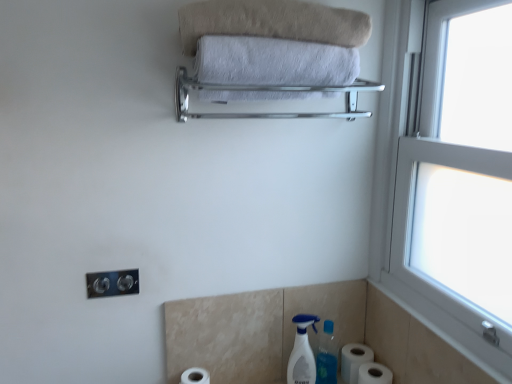
Question: From the image's perspective, does satin nickel outlet at lower left appear higher than beige soft towel at upper center, the 2th towel in the bottom-to-top sequence?

Choices:
 (A) no
 (B) yes

Answer: (A)

Question: Can you confirm if satin nickel outlet at lower left is taller than beige soft towel at upper center, the 2th towel in the bottom-to-top sequence?

Choices:
 (A) yes
 (B) no

Answer: (B)

Question: Is satin nickel outlet at lower left oriented towards beige soft towel at upper center, which is the 1th towel from top to bottom?

Choices:
 (A) yes
 (B) no

Answer: (B)

Question: Is satin nickel outlet at lower left positioned far away from beige soft towel at upper center, the 2th towel in the bottom-to-top sequence?

Choices:
 (A) no
 (B) yes

Answer: (A)

Question: Is satin nickel outlet at lower left closer to camera compared to beige soft towel at upper center, which is the 1th towel from top to bottom?

Choices:
 (A) no
 (B) yes

Answer: (A)

Question: Considering their positions, is silver metallic towel rack at upper center located in front of or behind white matte toilet paper at lower right, acting as the 2th toilet paper starting from the right?

Choices:
 (A) front
 (B) behind

Answer: (A)

Question: Is silver metallic towel rack at upper center inside the boundaries of white matte toilet paper at lower right, acting as the 2th toilet paper starting from the right, or outside?

Choices:
 (A) outside
 (B) inside

Answer: (A)

Question: From a real-world perspective, is silver metallic towel rack at upper center above or below white matte toilet paper at lower right, acting as the 2th toilet paper starting from the right?

Choices:
 (A) below
 (B) above

Answer: (B)

Question: Is point (253, 117) positioned closer to the camera than point (373, 359)?

Choices:
 (A) farther
 (B) closer

Answer: (B)

Question: Is white soft towel at upper center, which is the first towel in bottom-to-top order, spatially inside satin nickel outlet at lower left, or outside of it?

Choices:
 (A) inside
 (B) outside

Answer: (B)

Question: Based on their positions, is white soft towel at upper center, the second towel from the top, located to the left or right of satin nickel outlet at lower left?

Choices:
 (A) right
 (B) left

Answer: (A)

Question: Is white soft towel at upper center, the second towel from the top, in front of or behind satin nickel outlet at lower left in the image?

Choices:
 (A) behind
 (B) front

Answer: (B)

Question: From a real-world perspective, relative to satin nickel outlet at lower left, is white soft towel at upper center, the second towel from the top, vertically above or below?

Choices:
 (A) above
 (B) below

Answer: (A)

Question: Considering the positions of point (395, 3) and point (231, 114), is point (395, 3) closer or farther from the camera than point (231, 114)?

Choices:
 (A) closer
 (B) farther

Answer: (B)

Question: In terms of height, does white plastic window at right look taller or shorter compared to silver metallic towel rack at upper center?

Choices:
 (A) tall
 (B) short

Answer: (A)